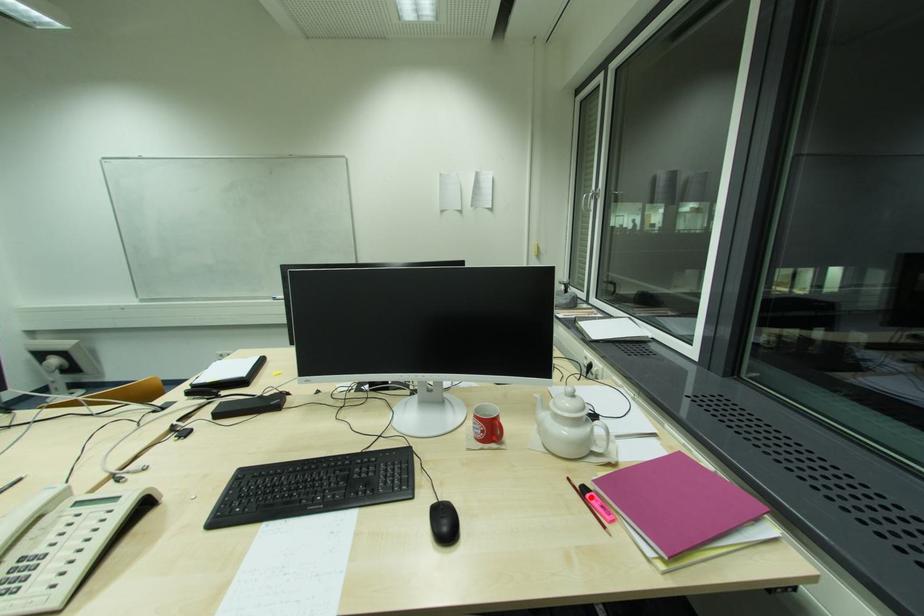
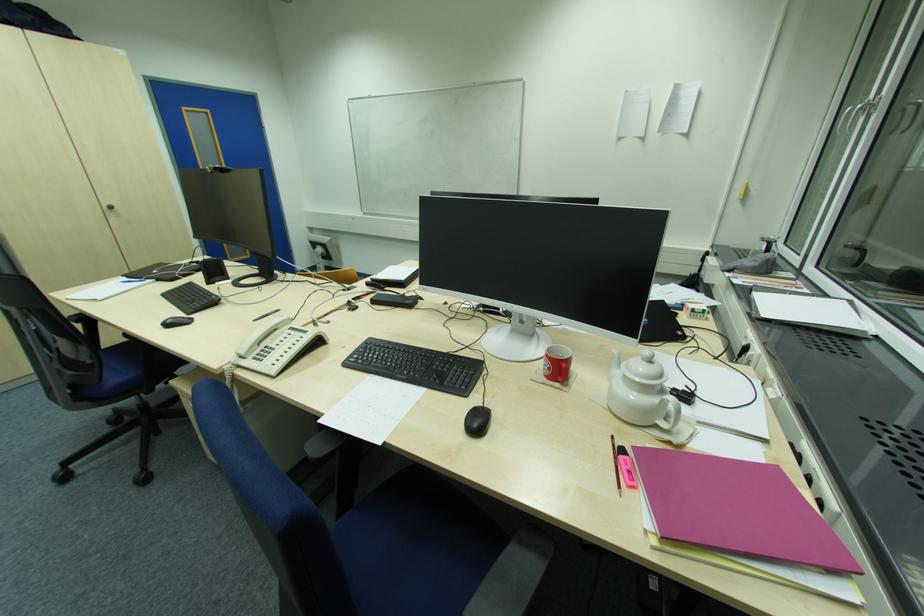
In the second image, find the point that corresponds to the highlighted location in the first image.

(623, 459)